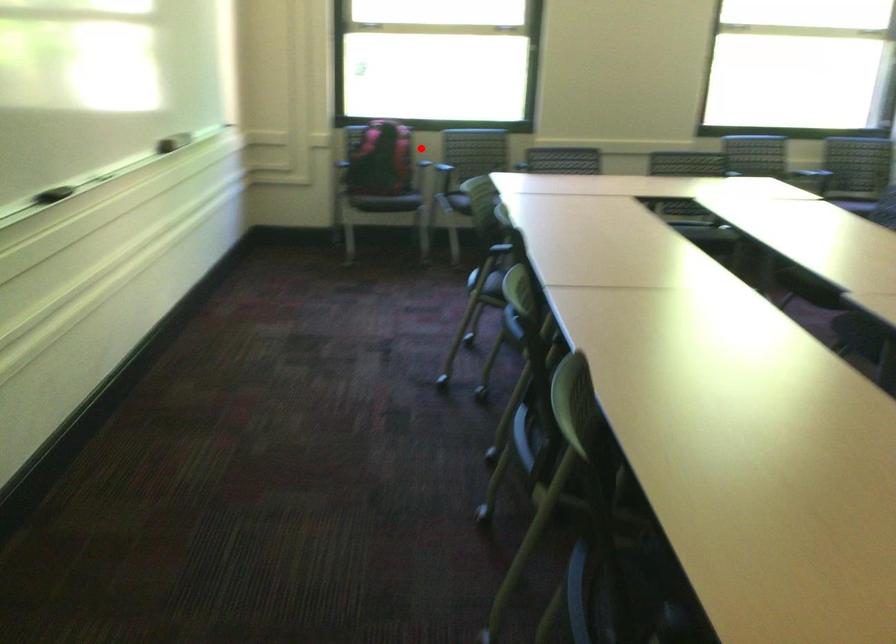
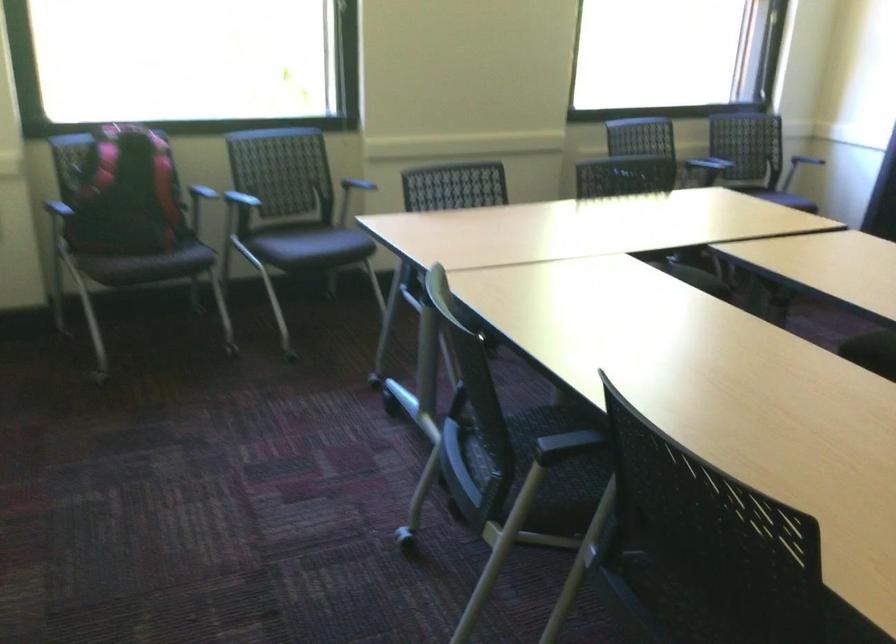
Question: I am providing you with two images of the same scene from different viewpoints. A red point is marked on the first image. At the location where the point appears in image 1, is it still visible in image 2?

Choices:
 (A) Yes
 (B) No

Answer: (A)